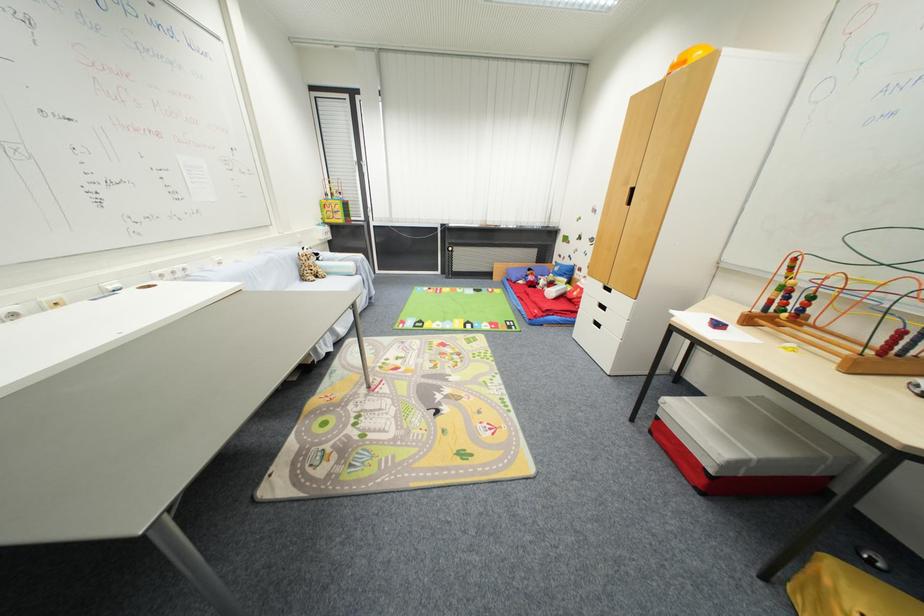
This screenshot has width=924, height=616. What are the coordinates of `grey striped lid` in the screenshot? It's located at (745, 424).